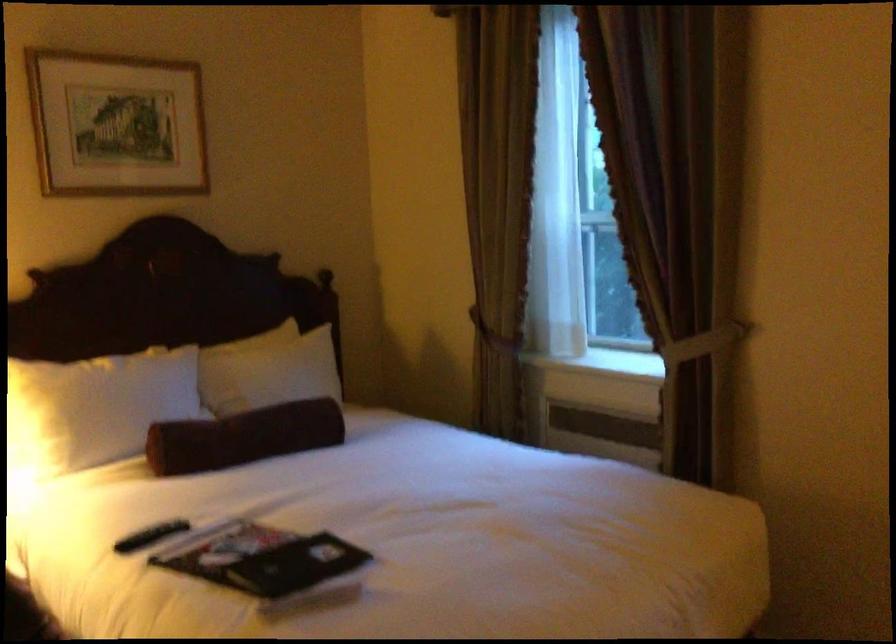
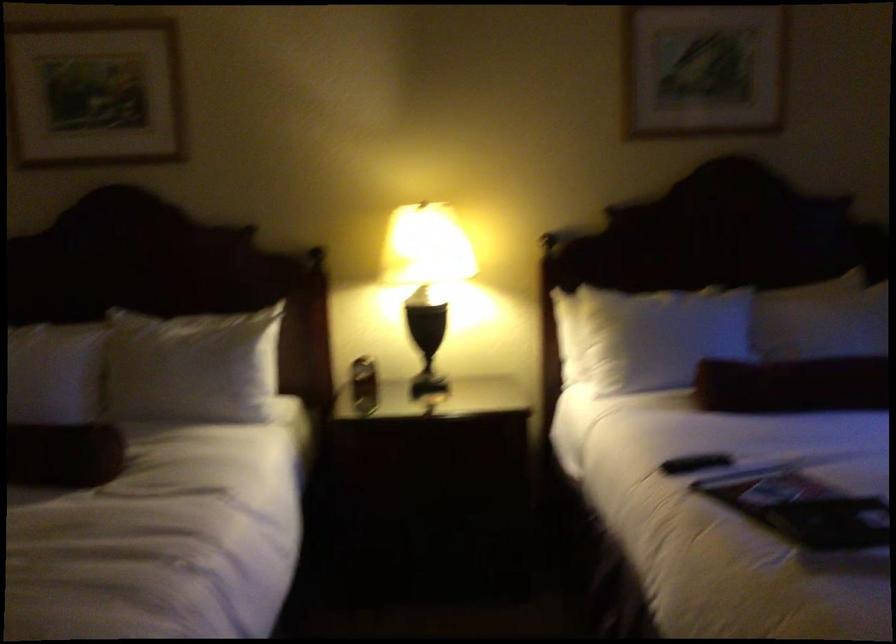
Locate, in the second image, the point that corresponds to [96,411] in the first image.

(652, 337)